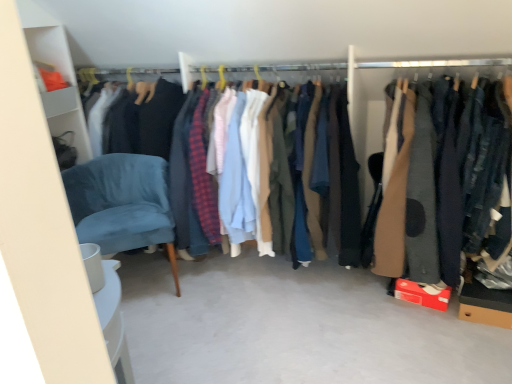
Question: From a real-world perspective, is velvet blue chair at lower left physically located above or below matte cotton shirts at center, which appears as the first clothing when viewed from the left?

Choices:
 (A) below
 (B) above

Answer: (A)

Question: Is velvet blue chair at lower left in front of or behind matte cotton shirts at center, the 2th clothing viewed from the right, in the image?

Choices:
 (A) behind
 (B) front

Answer: (A)

Question: Which of these objects is positioned farthest from the matte cotton shirts at center, which appears as the first clothing when viewed from the left?

Choices:
 (A) brown wool coat at right, arranged as the second clothing when viewed from the left
 (B) velvet blue chair at lower left

Answer: (A)

Question: Estimate the real-world distances between objects in this image. Which object is farther from the brown wool coat at right, arranged as the second clothing when viewed from the left?

Choices:
 (A) matte cotton shirts at center, the 2th clothing viewed from the right
 (B) velvet blue chair at lower left

Answer: (B)